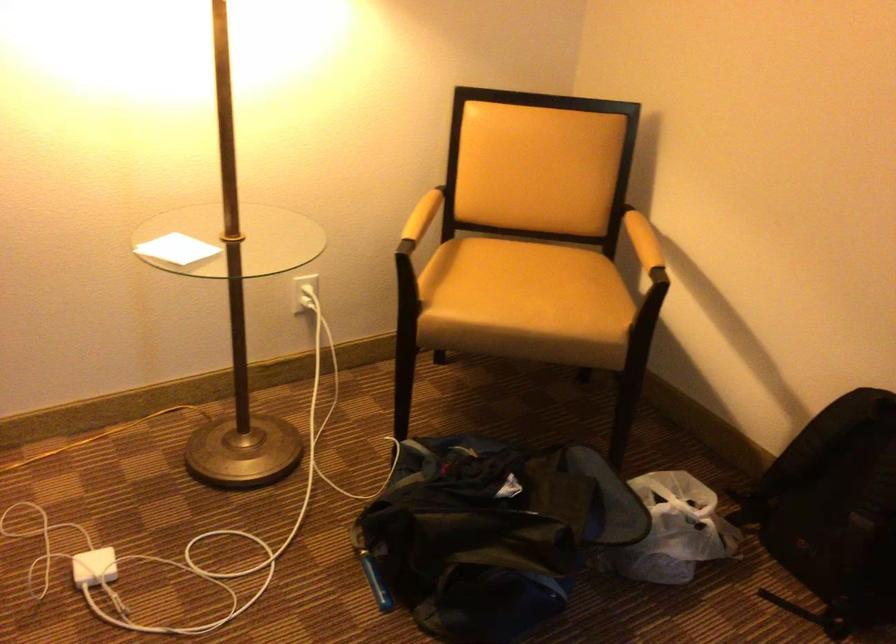
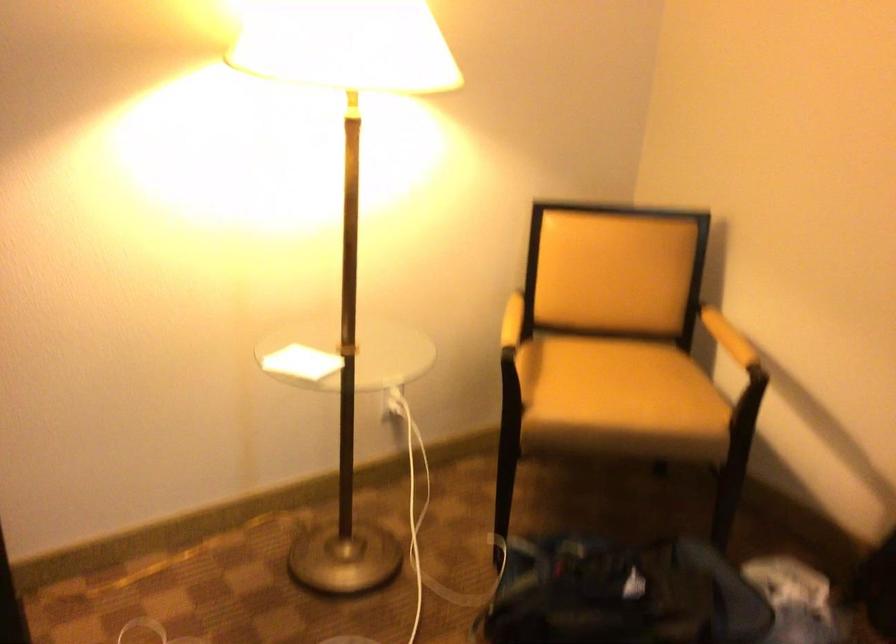
Question: The images are taken continuously from a first-person perspective. In which direction are you moving?

Choices:
 (A) Left
 (B) Right
 (C) Forward
 (D) Backward

Answer: (A)